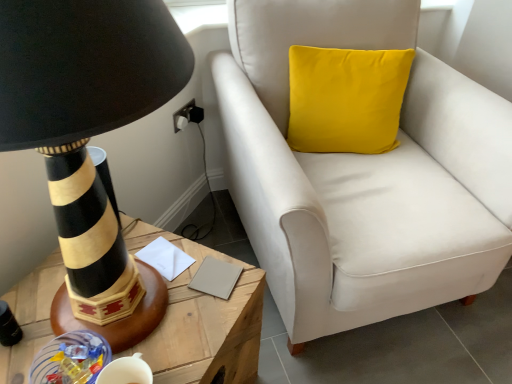
This screenshot has height=384, width=512. Describe the element at coordinates (165, 258) in the screenshot. I see `white paper at center, the first notepad viewed from the left` at that location.

In order to click on white paper at center, which is the 2th notepad in right-to-left order in this screenshot , I will do `click(165, 258)`.

Describe the element at coordinates (362, 174) in the screenshot. Image resolution: width=512 pixels, height=384 pixels. I see `velvet white armchair at upper right` at that location.

I want to click on velvet white armchair at upper right, so click(x=362, y=174).

Describe the element at coordinates (202, 321) in the screenshot. I see `wooden table at left` at that location.

Locate an element on the screen. Image resolution: width=512 pixels, height=384 pixels. beige matte notepad at center, which is the 2th notepad in left-to-right order is located at coordinates (216, 278).

What do you see at coordinates (216, 278) in the screenshot? The width and height of the screenshot is (512, 384). I see `beige matte notepad at center, which is the 2th notepad in left-to-right order` at bounding box center [216, 278].

I want to click on white paper at center, which is the 2th notepad in right-to-left order, so click(x=165, y=258).

Which object is thinner, velvet white armchair at upper right or white paper at center, which is the 2th notepad in right-to-left order?

white paper at center, which is the 2th notepad in right-to-left order, is thinner.

From a real-world perspective, which is physically above, velvet white armchair at upper right or white paper at center, which is the 2th notepad in right-to-left order?

In real-world perspective, white paper at center, which is the 2th notepad in right-to-left order, is above.

Considering the relative sizes of velvet white armchair at upper right and white paper at center, the first notepad viewed from the left, in the image provided, is velvet white armchair at upper right bigger than white paper at center, the first notepad viewed from the left,?

Yes, velvet white armchair at upper right is bigger than white paper at center, the first notepad viewed from the left.

Are velvet white armchair at upper right and white paper at center, which is the 2th notepad in right-to-left order, located far from each other?

That's not correct — velvet white armchair at upper right is a little close to white paper at center, which is the 2th notepad in right-to-left order.

The image size is (512, 384). In the image, there is a white paper at center, the first notepad viewed from the left. In order to click on lamp above it (from the image's perspective) in this screenshot , I will do `click(89, 136)`.

Considering the relative sizes of white paper at center, which is the 2th notepad in right-to-left order, and black striped lamp at left in the image provided, is white paper at center, which is the 2th notepad in right-to-left order, bigger than black striped lamp at left?

No, white paper at center, which is the 2th notepad in right-to-left order, is not bigger than black striped lamp at left.

Could black striped lamp at left be considered to be inside white paper at center, which is the 2th notepad in right-to-left order?

No, white paper at center, which is the 2th notepad in right-to-left order, does not contain black striped lamp at left.

How different are the orientations of white paper at center, the first notepad viewed from the left, and black striped lamp at left in degrees?

There is a 2.41-degree angle between the facing directions of white paper at center, the first notepad viewed from the left, and black striped lamp at left.

Is beige matte notepad at center, which is the 2th notepad in left-to-right order, oriented towards velvet white armchair at upper right?

Yes, beige matte notepad at center, which is the 2th notepad in left-to-right order, is oriented towards velvet white armchair at upper right.

Does beige matte notepad at center, which is the 2th notepad in left-to-right order, have a larger size compared to velvet white armchair at upper right?

Incorrect, beige matte notepad at center, which is the 2th notepad in left-to-right order, is not larger than velvet white armchair at upper right.

From the image's perspective, between beige matte notepad at center, which is the 2th notepad in left-to-right order, and velvet white armchair at upper right, which one is located above?

velvet white armchair at upper right is shown above in the image.

Which is more to the left, black striped lamp at left or velvet white armchair at upper right?

black striped lamp at left is more to the left.

Considering the sizes of objects black striped lamp at left and velvet white armchair at upper right in the image provided, who is taller, black striped lamp at left or velvet white armchair at upper right?

velvet white armchair at upper right is taller.

From the image's perspective, is black striped lamp at left under velvet white armchair at upper right?

Correct, black striped lamp at left appears lower than velvet white armchair at upper right in the image.

From a real-world perspective, is black striped lamp at left located beneath velvet white armchair at upper right?

No.

The image size is (512, 384). Find the location of `lamp above the wooden table at left (from a real-world perspective)`. lamp above the wooden table at left (from a real-world perspective) is located at coordinates (89, 136).

From the picture: Can you confirm if wooden table at left is positioned to the right of black striped lamp at left?

In fact, wooden table at left is to the left of black striped lamp at left.

Can you confirm if wooden table at left is thinner than black striped lamp at left?

No, wooden table at left is not thinner than black striped lamp at left.

From a real-world perspective, is wooden table at left physically below black striped lamp at left?

Yes, from a real-world perspective, wooden table at left is below black striped lamp at left.

Measure the distance between black striped lamp at left and wooden table at left.

black striped lamp at left is 22.02 centimeters away from wooden table at left.

Is black striped lamp at left aimed at wooden table at left?

No, black striped lamp at left is not oriented towards wooden table at left.

Does point (95, 238) come in front of point (25, 360)?

Yes, point (95, 238) is closer to viewer.

Considering their positions, is black striped lamp at left located in front of or behind wooden table at left?

black striped lamp at left is in front of wooden table at left.

Could you tell me if velvet white armchair at upper right is turned towards wooden table at left?

No.

Is velvet white armchair at upper right positioned beyond the bounds of wooden table at left?

That's correct, velvet white armchair at upper right is outside of wooden table at left.

Considering the relative sizes of velvet white armchair at upper right and wooden table at left in the image provided, is velvet white armchair at upper right taller than wooden table at left?

Indeed, velvet white armchair at upper right has a greater height compared to wooden table at left.

Is velvet white armchair at upper right bigger than wooden table at left?

Yes, velvet white armchair at upper right is bigger than wooden table at left.

This screenshot has width=512, height=384. In the image, there is a white paper at center, which is the 2th notepad in right-to-left order. In order to click on chair below it (from a real-world perspective) in this screenshot , I will do `click(362, 174)`.

There is a black striped lamp at left. At what (x,y) coordinates should I click in order to perform the action: click on the 1st notepad below it (from the image's perspective). Please return your answer as a coordinate pair (x, y). The width and height of the screenshot is (512, 384). Looking at the image, I should click on (165, 258).

Considering their positions, is white paper at center, the first notepad viewed from the left, positioned closer to beige matte notepad at center, which is the 2th notepad in left-to-right order, than velvet white armchair at upper right?

white paper at center, the first notepad viewed from the left, lies closer to beige matte notepad at center, which is the 2th notepad in left-to-right order, than the other object.

Considering their positions, is velvet white armchair at upper right positioned closer to wooden table at left than white paper at center, the first notepad viewed from the left?

white paper at center, the first notepad viewed from the left, is positioned closer to the anchor wooden table at left.

Which object lies nearer to the anchor point beige matte notepad at center, which is the 2th notepad in left-to-right order, wooden table at left or white paper at center, which is the 2th notepad in right-to-left order?

Among the two, white paper at center, which is the 2th notepad in right-to-left order, is located nearer to beige matte notepad at center, which is the 2th notepad in left-to-right order.

Looking at the image, which one is located closer to velvet white armchair at upper right, wooden table at left or white paper at center, the first notepad viewed from the left?

The object closer to velvet white armchair at upper right is wooden table at left.

From the image, which object appears to be farther from velvet white armchair at upper right, black striped lamp at left or wooden table at left?

black striped lamp at left lies further to velvet white armchair at upper right than the other object.

Looking at the image, which one is located further to wooden table at left, velvet white armchair at upper right or black striped lamp at left?

Based on the image, velvet white armchair at upper right appears to be further to wooden table at left.

Estimate the real-world distances between objects in this image. Which object is further from velvet white armchair at upper right, black striped lamp at left or beige matte notepad at center, the first notepad when ordered from right to left?

black striped lamp at left lies further to velvet white armchair at upper right than the other object.

Consider the image. From the image, which object appears to be nearer to white paper at center, which is the 2th notepad in right-to-left order, velvet white armchair at upper right or beige matte notepad at center, which is the 2th notepad in left-to-right order?

Based on the image, beige matte notepad at center, which is the 2th notepad in left-to-right order, appears to be nearer to white paper at center, which is the 2th notepad in right-to-left order.

The height and width of the screenshot is (384, 512). In order to click on notepad located between black striped lamp at left and white paper at center, which is the 2th notepad in right-to-left order, in the depth direction in this screenshot , I will do `click(216, 278)`.

Locate an element on the screen. The width and height of the screenshot is (512, 384). notepad situated between white paper at center, the first notepad viewed from the left, and velvet white armchair at upper right from left to right is located at coordinates (216, 278).

The height and width of the screenshot is (384, 512). In order to click on table located between black striped lamp at left and beige matte notepad at center, which is the 2th notepad in left-to-right order, in the depth direction in this screenshot , I will do [202, 321].

Image resolution: width=512 pixels, height=384 pixels. Identify the location of notepad positioned between wooden table at left and white paper at center, which is the 2th notepad in right-to-left order, from near to far. (216, 278).